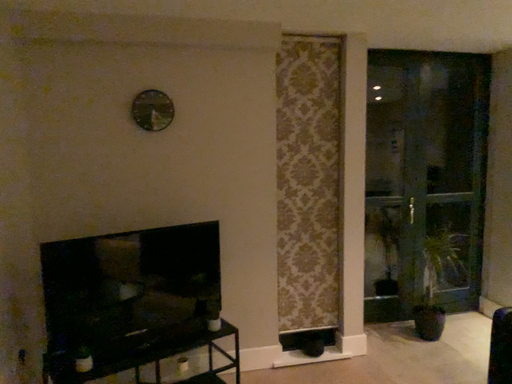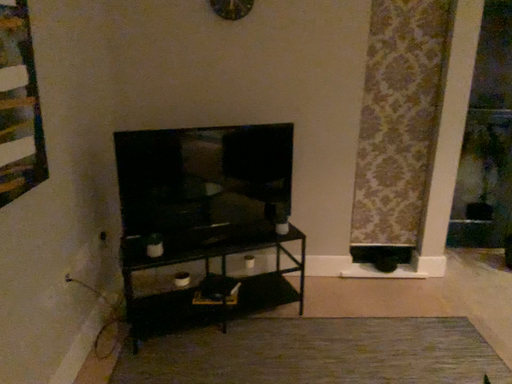
Question: How did the camera likely rotate when shooting the video?

Choices:
 (A) rotated downward
 (B) rotated upward

Answer: (A)